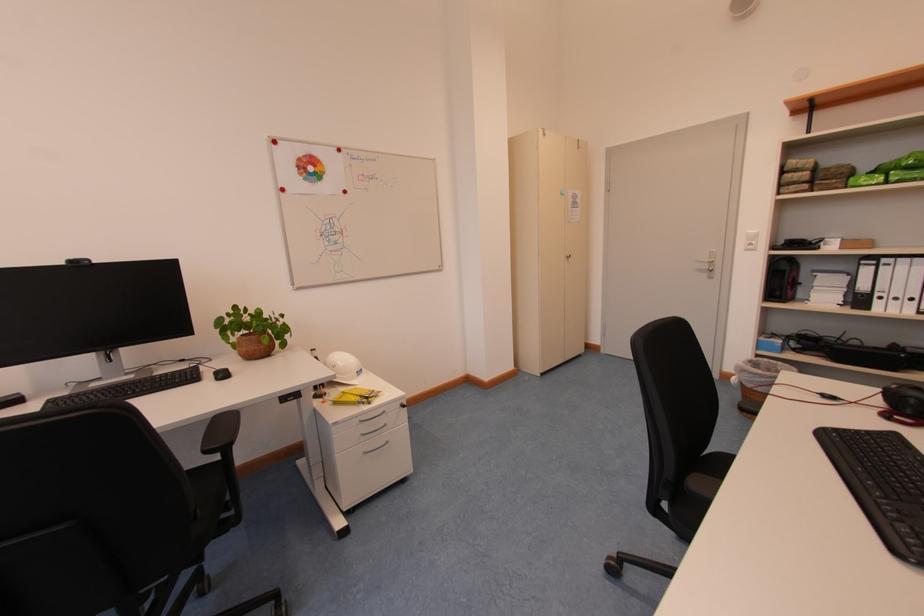
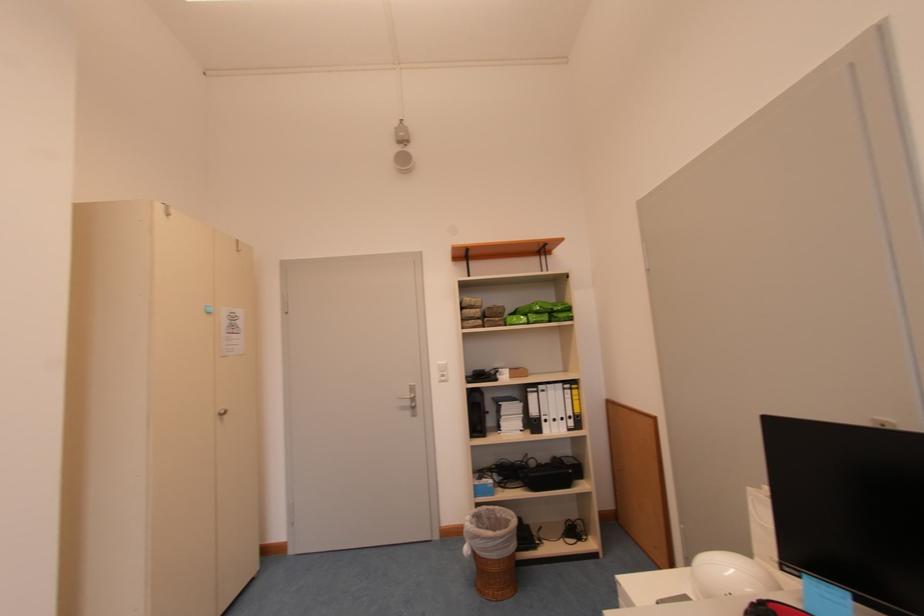
Find the pixel in the second image that matches (712,270) in the first image.

(415, 406)